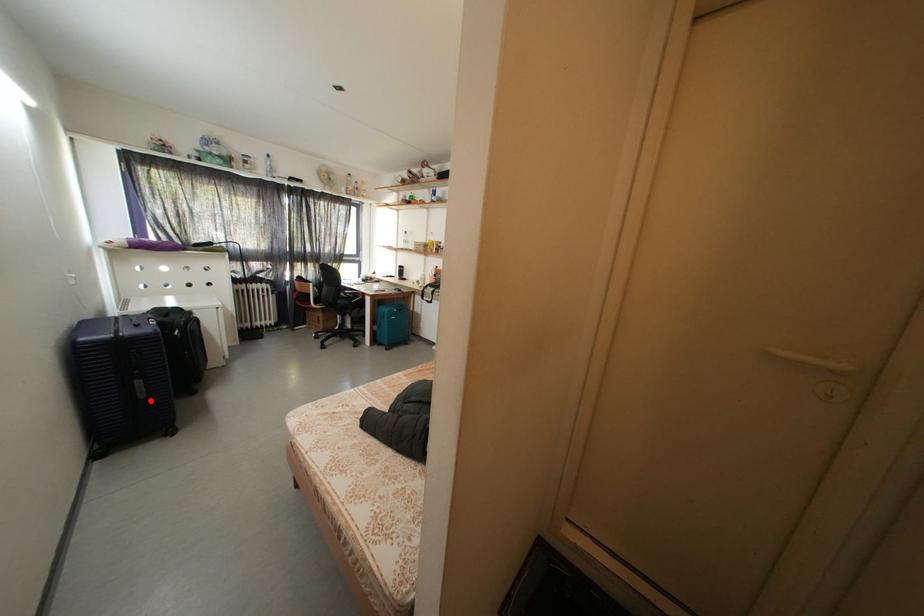
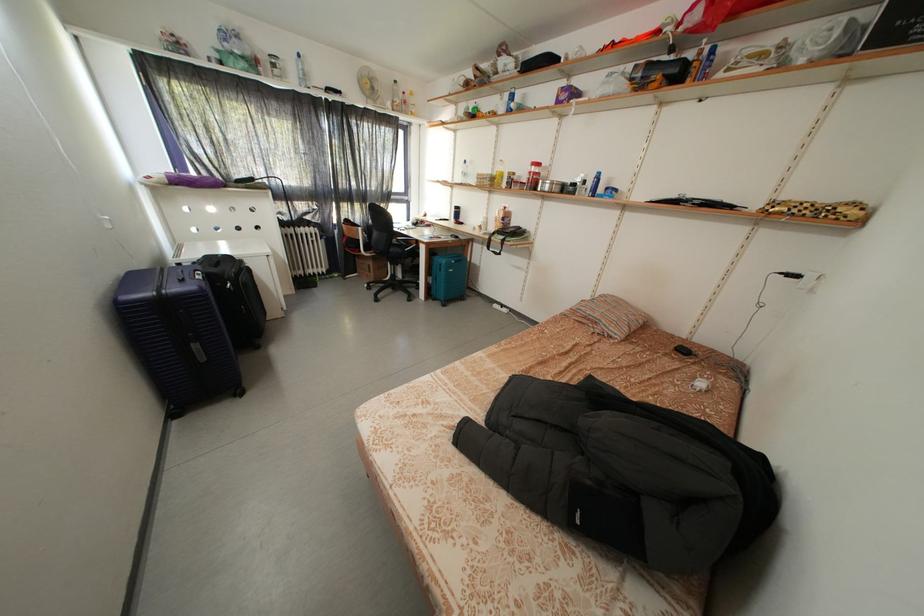
Question: I am providing you with two images of the same scene from different viewpoints. Given a red point in image1, look at the same physical point in image2. Is it:

Choices:
 (A) Closer to the viewpoint
 (B) Farther from the viewpoint

Answer: (A)